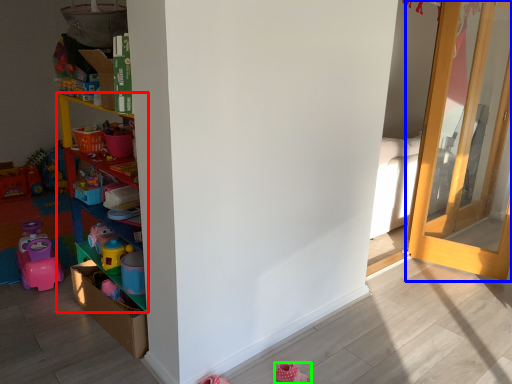
Question: Estimate the real-world distances between objects in this image. Which object is closer to shelf (highlighted by a red box), door (highlighted by a blue box) or shoe (highlighted by a green box)?

Choices:
 (A) door
 (B) shoe

Answer: (B)